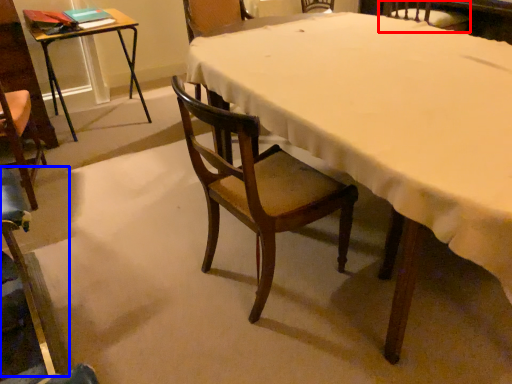
Question: Which point is further to the camera, chair (highlighted by a red box) or chair (highlighted by a blue box)?

Choices:
 (A) chair
 (B) chair

Answer: (A)